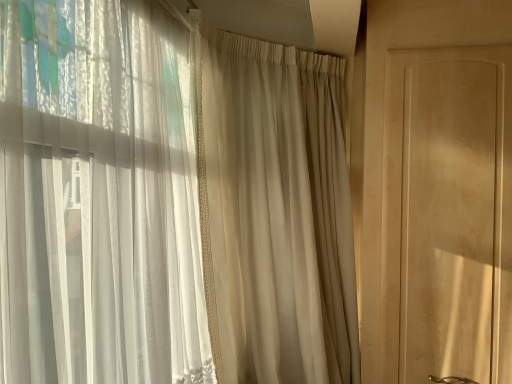
Question: Considering the relative positions of matte wood screen door at right and beige sheer curtain at center in the image provided, is matte wood screen door at right to the left of beige sheer curtain at center from the viewer's perspective?

Choices:
 (A) no
 (B) yes

Answer: (A)

Question: Is matte wood screen door at right facing away from beige sheer curtain at center?

Choices:
 (A) yes
 (B) no

Answer: (B)

Question: Is matte wood screen door at right facing towards beige sheer curtain at center?

Choices:
 (A) no
 (B) yes

Answer: (A)

Question: From a real-world perspective, does matte wood screen door at right stand above beige sheer curtain at center?

Choices:
 (A) no
 (B) yes

Answer: (B)

Question: Are matte wood screen door at right and beige sheer curtain at center far apart?

Choices:
 (A) yes
 (B) no

Answer: (B)

Question: Is matte wood screen door at right bigger than beige sheer curtain at center?

Choices:
 (A) no
 (B) yes

Answer: (A)

Question: Is beige sheer curtain at center in contact with matte wood screen door at right?

Choices:
 (A) yes
 (B) no

Answer: (B)

Question: Does beige sheer curtain at center have a greater width compared to matte wood screen door at right?

Choices:
 (A) yes
 (B) no

Answer: (A)

Question: Does beige sheer curtain at center have a lesser width compared to matte wood screen door at right?

Choices:
 (A) no
 (B) yes

Answer: (A)

Question: From the image's perspective, does beige sheer curtain at center appear higher than matte wood screen door at right?

Choices:
 (A) no
 (B) yes

Answer: (A)

Question: Is beige sheer curtain at center positioned behind matte wood screen door at right?

Choices:
 (A) no
 (B) yes

Answer: (A)

Question: Is beige sheer curtain at center to the right of matte wood screen door at right from the viewer's perspective?

Choices:
 (A) no
 (B) yes

Answer: (A)

Question: Is beige sheer curtain at center inside or outside of matte wood screen door at right?

Choices:
 (A) inside
 (B) outside

Answer: (B)